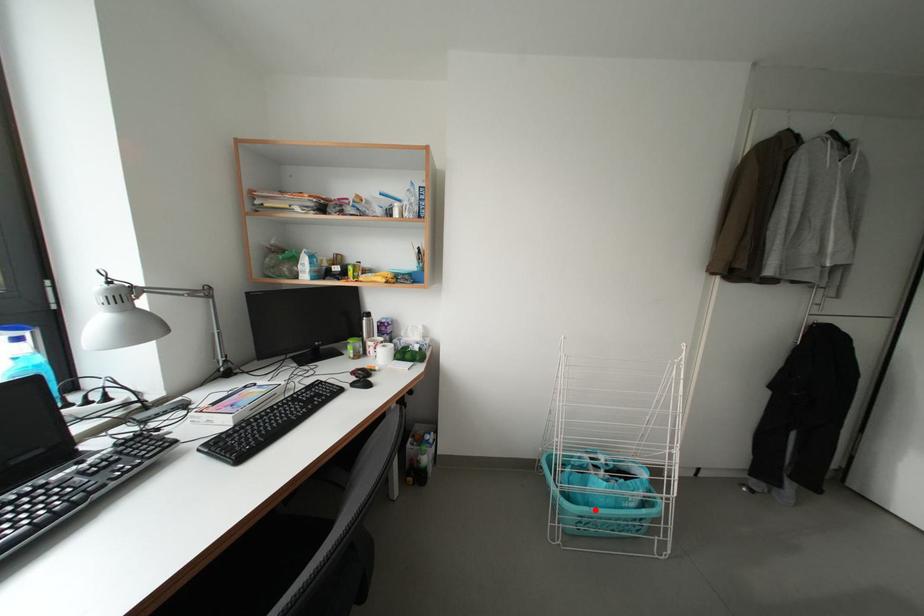
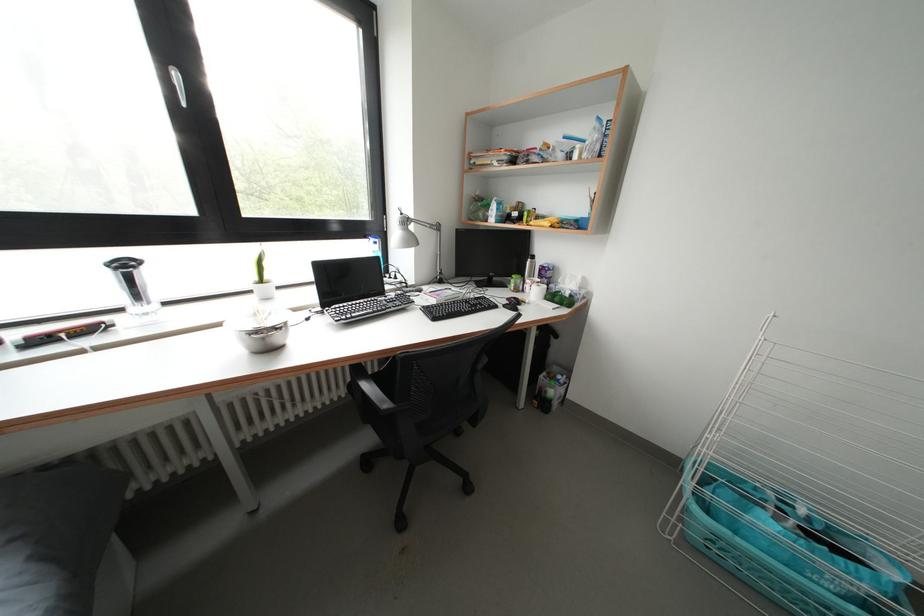
Question: I am providing you with two images of the same scene from different viewpoints. Given a red point in image1, look at the same physical point in image2. Is it:

Choices:
 (A) Closer to the viewpoint
 (B) Farther from the viewpoint

Answer: (A)